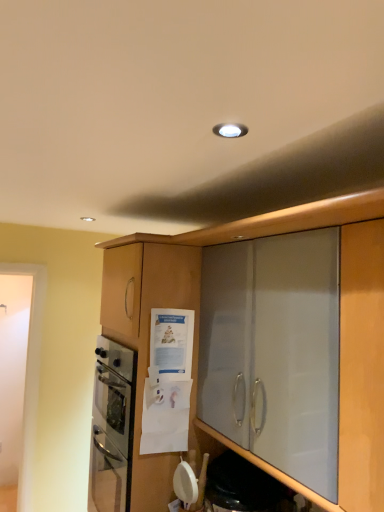
Question: Can you confirm if matte wood cabinet at center is positioned to the right of transparent glass shelf at lower center?

Choices:
 (A) yes
 (B) no

Answer: (B)

Question: Can you confirm if matte wood cabinet at center is shorter than transparent glass shelf at lower center?

Choices:
 (A) yes
 (B) no

Answer: (B)

Question: Does matte wood cabinet at center appear on the left side of transparent glass shelf at lower center?

Choices:
 (A) yes
 (B) no

Answer: (A)

Question: Is matte wood cabinet at center far from transparent glass shelf at lower center?

Choices:
 (A) no
 (B) yes

Answer: (A)

Question: Does matte wood cabinet at center have a larger size compared to transparent glass shelf at lower center?

Choices:
 (A) yes
 (B) no

Answer: (A)

Question: Is matte wood cabinet at center looking in the opposite direction of transparent glass shelf at lower center?

Choices:
 (A) yes
 (B) no

Answer: (B)

Question: From a real-world perspective, is transparent glass shelf at lower center located beneath matte wood cabinet at center?

Choices:
 (A) yes
 (B) no

Answer: (A)

Question: Is transparent glass shelf at lower center far away from matte wood cabinet at center?

Choices:
 (A) yes
 (B) no

Answer: (B)

Question: Is transparent glass shelf at lower center located outside matte wood cabinet at center?

Choices:
 (A) no
 (B) yes

Answer: (B)

Question: Considering the relative positions of transparent glass shelf at lower center and matte wood cabinet at center in the image provided, is transparent glass shelf at lower center in front of matte wood cabinet at center?

Choices:
 (A) no
 (B) yes

Answer: (B)

Question: Is transparent glass shelf at lower center to the right of matte wood cabinet at center from the viewer's perspective?

Choices:
 (A) no
 (B) yes

Answer: (B)

Question: Could matte wood cabinet at center be considered to be inside transparent glass shelf at lower center?

Choices:
 (A) yes
 (B) no

Answer: (B)

Question: Looking at the image, does matte wood cabinet at center seem bigger or smaller compared to transparent glass shelf at lower center?

Choices:
 (A) small
 (B) big

Answer: (B)